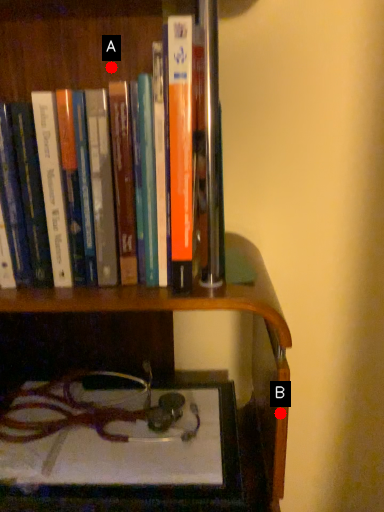
Question: Two points are circled on the image, labeled by A and B beside each circle. Which point is farther from the camera taking this photo?

Choices:
 (A) A is further
 (B) B is further

Answer: (A)